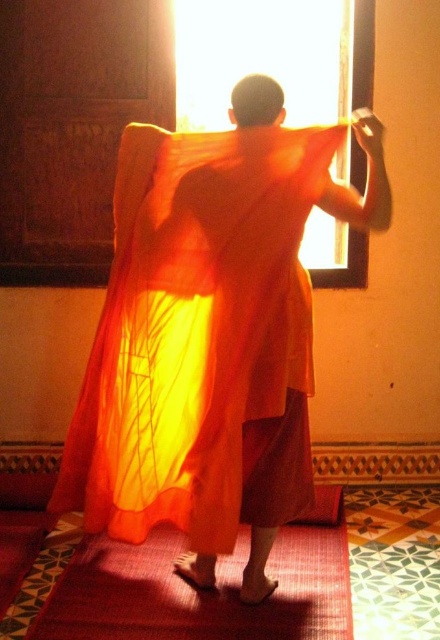
You are a visitor in the room and want to place a 36 inch long decorative mat between the translucent orange dress at center and the matte red carpet at lower center. Is there enough space to place it without overlapping either object?

The translucent orange dress at center is 34.67 inches away from the matte red carpet at lower center. Since the decorative mat is 36 inches long, it would require more space than available, so it cannot be placed without overlapping either object.

You are a visitor in a temple and you see the translucent orange dress at center and the matte red carpet at lower center. Which object is located to the left when viewed from the front?

The translucent orange dress at center is positioned on the left side of the matte red carpet at lower center, so it is located to the left when viewed from the front.